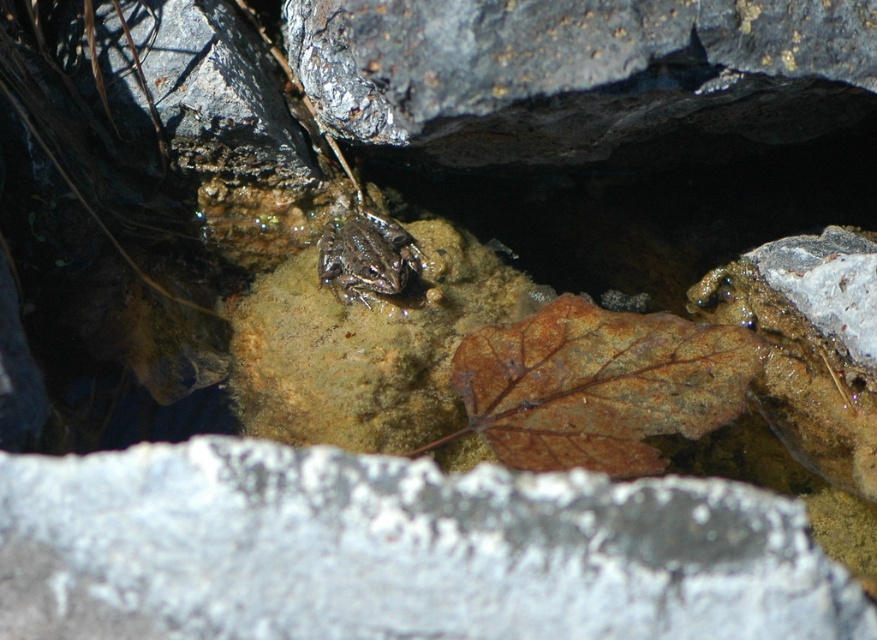
You are a frog sitting on the rough gray rock at upper center and want to jump to the brown matte leaf at center. Can you reach it without stretching your legs too much?

The rough gray rock at upper center is bigger than the brown matte leaf at center, so the frog can easily jump from the rough gray rock at upper center to the brown matte leaf at center without needing to stretch its legs too much.

You are standing at the point labeled as point (576, 72) in the image. What type of rock are you standing on?

You are standing on a rough gray rock at upper center.

You are a photographer aiming to capture the camouflage skin frog at center. You notice a white rough stone at center in the background. Which object is located to the right of the frog?

The white rough stone at center is positioned on the right side of camouflage skin frog at center, so the white rough stone at center is to the right of the frog.